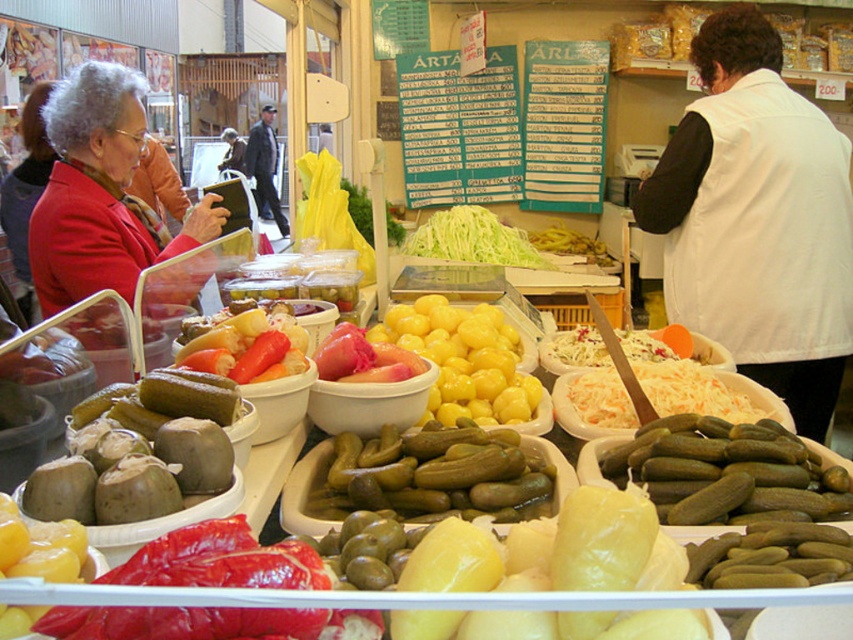
Is green pickles at center to the left of shredded white cabbage at center from the viewer's perspective?

Yes, green pickles at center is to the left of shredded white cabbage at center.

Is point (399, 448) positioned in front of point (657, 388)?

That is True.

Is point (407, 476) farther from viewer compared to point (624, 390)?

No.

Image resolution: width=853 pixels, height=640 pixels. What are the coordinates of `green pickles at center` in the screenshot? It's located at (432, 474).

Describe the element at coordinates (757, 220) in the screenshot. I see `white cotton vest at center` at that location.

Is the position of white cotton vest at center more distant than that of shredded white cabbage at center?

Yes, white cotton vest at center is further from the viewer.

What do you see at coordinates (757, 220) in the screenshot?
I see `white cotton vest at center` at bounding box center [757, 220].

Locate an element on the screen. The height and width of the screenshot is (640, 853). white cotton vest at center is located at coordinates (757, 220).

Describe the element at coordinates (39, 547) in the screenshot. This screenshot has height=640, width=853. I see `shiny red pepper at lower left` at that location.

Between shiny red pepper at lower left and yellow glossy pickles at center, which one appears on the right side from the viewer's perspective?

Answer: yellow glossy pickles at center is more to the right.

Between point (4, 566) and point (560, 248), which one is positioned in front?

Positioned in front is point (4, 566).

Find the location of `shiny red pepper at lower left`. shiny red pepper at lower left is located at coordinates (39, 547).